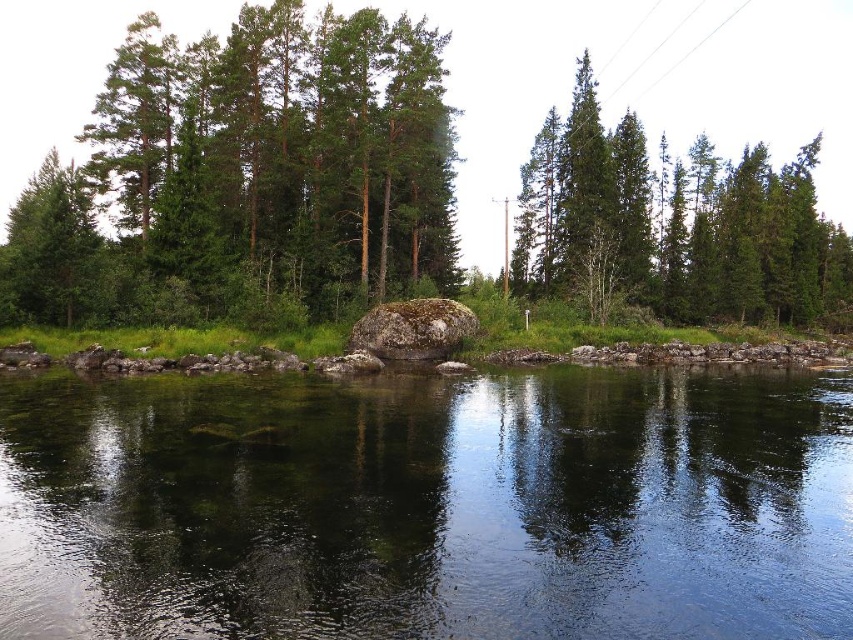
Is green mossy rock at center above green matte tree at left?

Yes.

Can you confirm if green mossy rock at center is positioned to the right of green matte tree at left?

Yes, green mossy rock at center is to the right of green matte tree at left.

This screenshot has height=640, width=853. Describe the element at coordinates (247, 177) in the screenshot. I see `green mossy rock at center` at that location.

The width and height of the screenshot is (853, 640). Identify the location of green mossy rock at center. (247, 177).

Is point (636, 433) positioned in front of point (71, 189)?

Yes.

Image resolution: width=853 pixels, height=640 pixels. What are the coordinates of `clear water at center` in the screenshot? It's located at (427, 506).

In the scene shown: Who is positioned more to the right, green matte tree at center or green matte tree at left?

green matte tree at center

Is point (721, 260) closer to camera compared to point (12, 257)?

No, (721, 260) is behind (12, 257).

In order to click on green matte tree at center in this screenshot , I will do `click(672, 225)`.